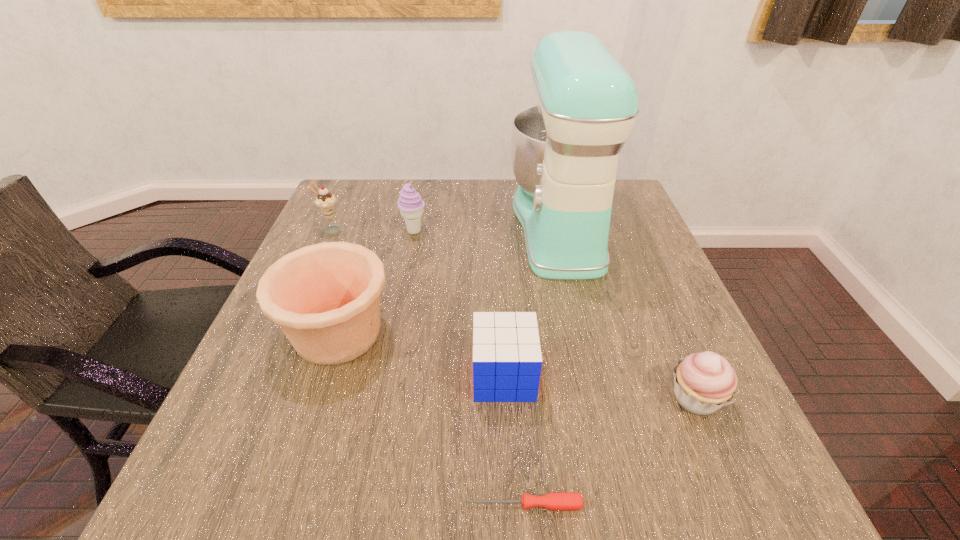
Locate an element on the screen. free space between the pottery and the shortest object is located at coordinates (431, 418).

Identify which object is located as the third nearest to the mixer. Please provide its 2D coordinates. Your answer should be formatted as a tuple, i.e. [(x, y)], where the tuple contains the x and y coordinates of a point satisfying the conditions above.

[(325, 297)]

Identify the location of the sixth closest object relative to the right icecream. click(x=558, y=501).

Image resolution: width=960 pixels, height=540 pixels. What are the coordinates of `vacant space that satisfies the following two spatial constraints: 1. on the front side of the pottery; 2. on the right side of the left icecream` in the screenshot? It's located at (286, 333).